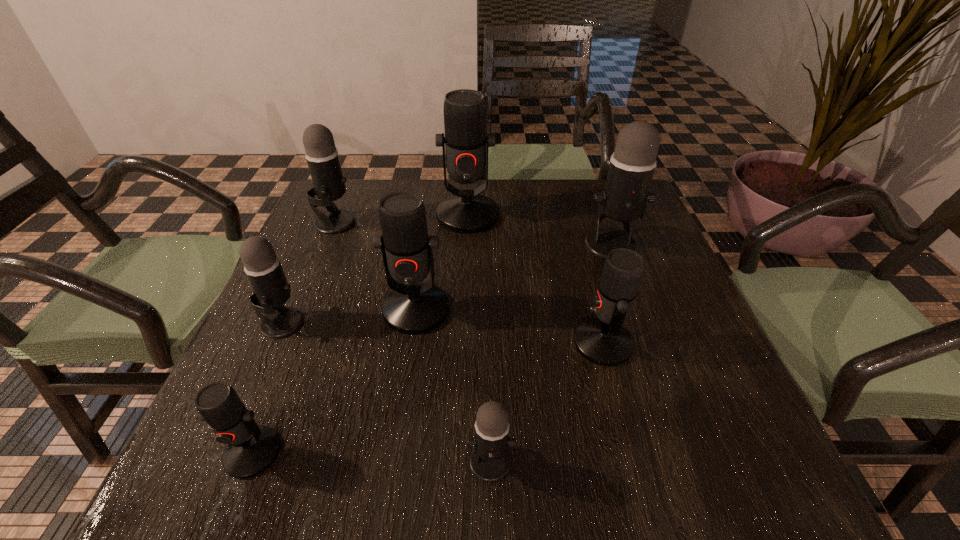
I want to click on vacant area situated 0.080m on the side of the biggest red microphone with the red ring, so click(x=467, y=253).

Locate an element on the screen. The width and height of the screenshot is (960, 540). vacant area situated 0.240m on the back of the biggest gray microphone is located at coordinates (588, 183).

Find the location of a particular element. The height and width of the screenshot is (540, 960). free location located 0.150m on the back of the third smallest gray microphone is located at coordinates (352, 183).

The image size is (960, 540). I want to click on vacant area situated 0.130m on the side of the third smallest red microphone with the red ring, so click(404, 390).

The width and height of the screenshot is (960, 540). Identify the location of vacant space located on the side of the rightmost red microphone with the red ring. [549, 343].

You are a GUI agent. You are given a task and a screenshot of the screen. Output one action in this format:
    pyautogui.click(x=<x>, y=<y>)
    Task: Click on the free region located 0.160m on the side of the rightmost red microphone with the red ring
    Image resolution: width=960 pixels, height=540 pixels.
    Given the screenshot: What is the action you would take?
    pyautogui.click(x=493, y=343)

This screenshot has height=540, width=960. In order to click on vacant region located on the side of the rightmost red microphone with the red ring in this screenshot , I will do `click(524, 343)`.

At what (x,y) coordinates should I click in order to perform the action: click on blank space located on the front of the second smallest gray microphone. Please return your answer as a coordinate pair (x, y). This screenshot has height=540, width=960. Looking at the image, I should click on (248, 401).

Locate an element on the screen. The height and width of the screenshot is (540, 960). vacant space located 0.050m on the right of the smallest gray microphone is located at coordinates (544, 462).

Locate an element on the screen. This screenshot has width=960, height=540. object at the far left corner is located at coordinates (322, 157).